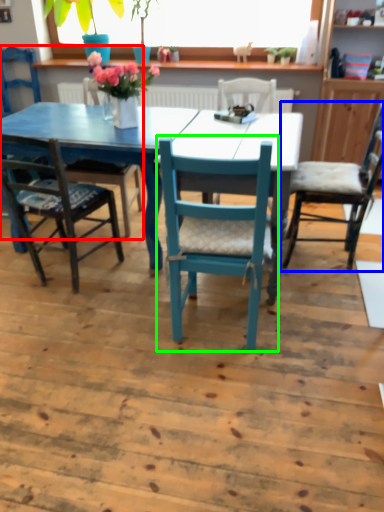
Question: Based on their relative distances, which object is farther from chair (highlighted by a red box)? Choose from chair (highlighted by a blue box) and chair (highlighted by a green box).

Choices:
 (A) chair
 (B) chair

Answer: (A)